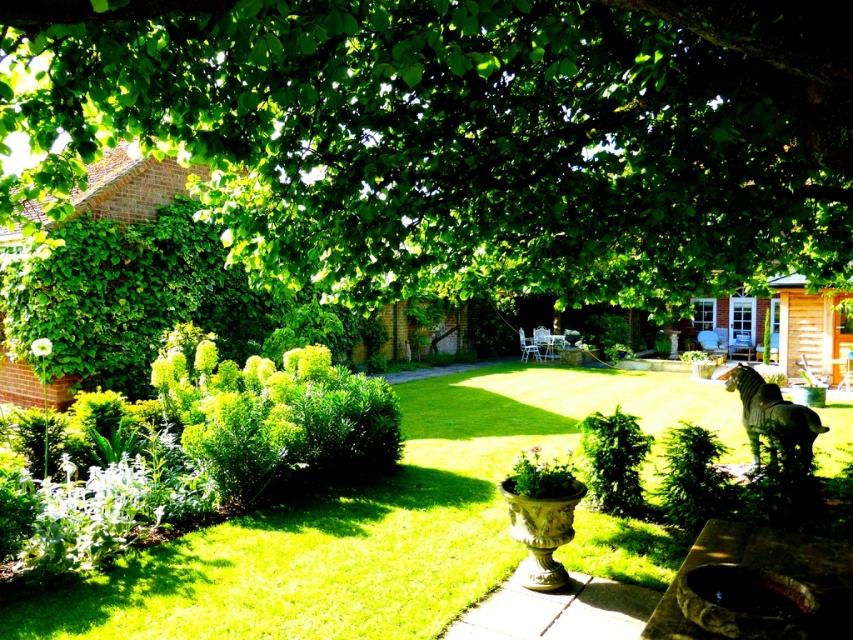
You are a gardener who wants to place a new decorative item in the garden. The bronze statue at center is currently occupying space. If you want to replace it with the green leafy tree at upper center, would the tree fit in the same spot considering their thickness?

The green leafy tree at upper center is thinner than the bronze statue at center, so it would fit in the same spot since it has a smaller width.

You are a gardener who wants to plant a new tree that requires full sunlight. You see the green leafy tree at upper center and the bronze statue at center. Which object might cast a smaller shadow, allowing more sunlight to reach the new tree?

The bronze statue at center is shorter than the green leafy tree at upper center, so it will cast a smaller shadow, allowing more sunlight to reach the new tree.